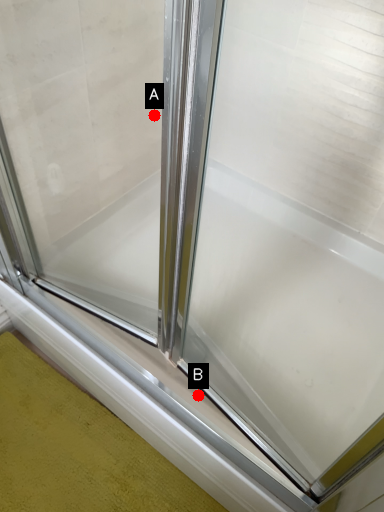
Question: Two points are circled on the image, labeled by A and B beside each circle. Among these points, which one is farthest from the camera?

Choices:
 (A) A is further
 (B) B is further

Answer: (A)